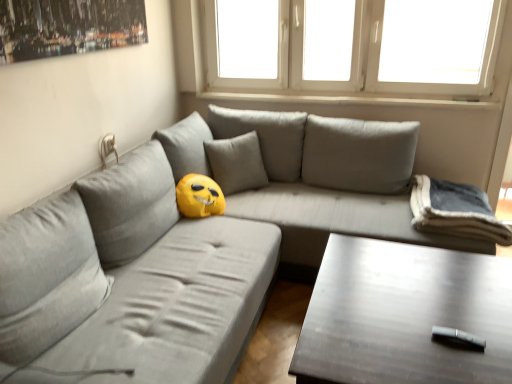
The image size is (512, 384). Identify the location of free spot below white plastic window at upper center (from a real-world perspective). (343, 97).